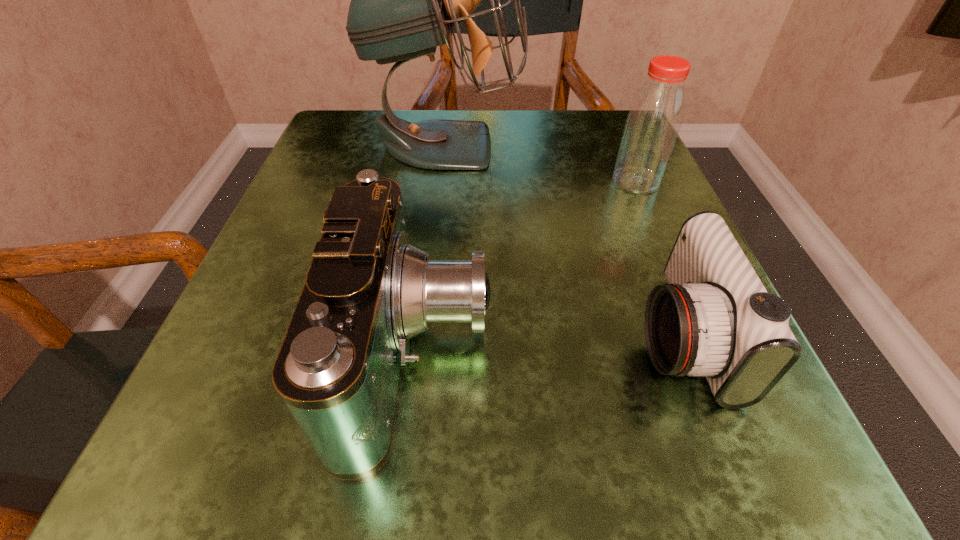
Image resolution: width=960 pixels, height=540 pixels. Find the location of `fan`. fan is located at coordinates (404, 0).

Locate an element on the screen. The width and height of the screenshot is (960, 540). bottle is located at coordinates (655, 116).

Locate an element on the screen. the left camcorder is located at coordinates (368, 291).

In order to click on the second shortest object in this screenshot , I will do `click(368, 291)`.

Where is `the shortest object`? This screenshot has width=960, height=540. the shortest object is located at coordinates (715, 318).

This screenshot has height=540, width=960. Identify the location of the right camcorder. pyautogui.click(x=715, y=318).

What are the coordinates of `vacant area situated 0.130m on the front-facing side of the fan for air flow` in the screenshot? It's located at (585, 145).

The height and width of the screenshot is (540, 960). Identify the location of free space located 0.320m on the front of the bottle. (708, 347).

Where is `vacant space located on the front-facing side of the third tallest object`? vacant space located on the front-facing side of the third tallest object is located at coordinates (564, 353).

Where is `free space located 0.380m on the surface of the right camcorder`? free space located 0.380m on the surface of the right camcorder is located at coordinates (339, 336).